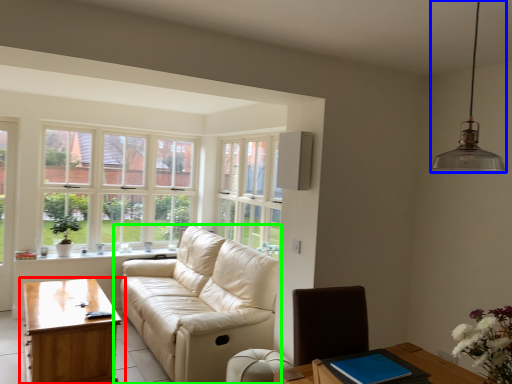
Question: Based on their relative distances, which object is farther from table (highlighted by a red box)? Choose from light fixture (highlighted by a blue box) and studio couch (highlighted by a green box).

Choices:
 (A) light fixture
 (B) studio couch

Answer: (A)